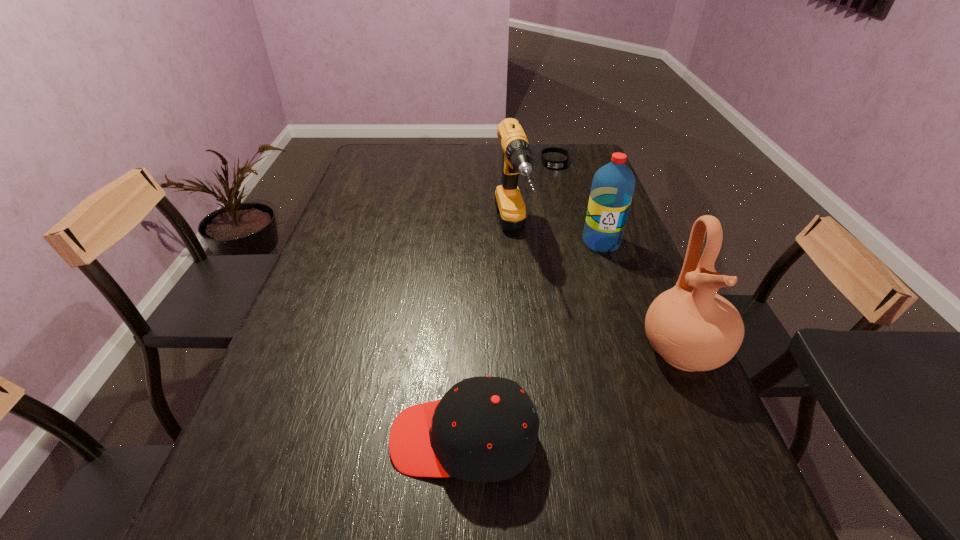
This screenshot has height=540, width=960. Find the location of `object that is at the near edge`. object that is at the near edge is located at coordinates pos(484,429).

This screenshot has width=960, height=540. Identify the location of pottery present at the right edge. (692, 328).

I want to click on wristband at the right edge, so click(x=549, y=164).

This screenshot has height=540, width=960. I want to click on water bottle present at the right edge, so click(x=613, y=185).

You are a GUI agent. You are given a task and a screenshot of the screen. Output one action in this format:
    pyautogui.click(x=<x>, y=<y>)
    Task: Click on the object that is at the far right corner
    The height and width of the screenshot is (540, 960).
    Given the screenshot: What is the action you would take?
    pyautogui.click(x=549, y=164)

This screenshot has width=960, height=540. In order to click on vacant region at the near edge of the desktop in this screenshot , I will do `click(372, 470)`.

The height and width of the screenshot is (540, 960). I want to click on vacant space at the left edge of the desktop, so click(x=369, y=225).

Locate an element on the screen. The image size is (960, 540). vacant space at the right edge of the desktop is located at coordinates (603, 306).

Locate an element on the screen. This screenshot has width=960, height=540. free space at the far right corner is located at coordinates (574, 147).

I want to click on vacant space at the near right corner of the desktop, so click(717, 481).